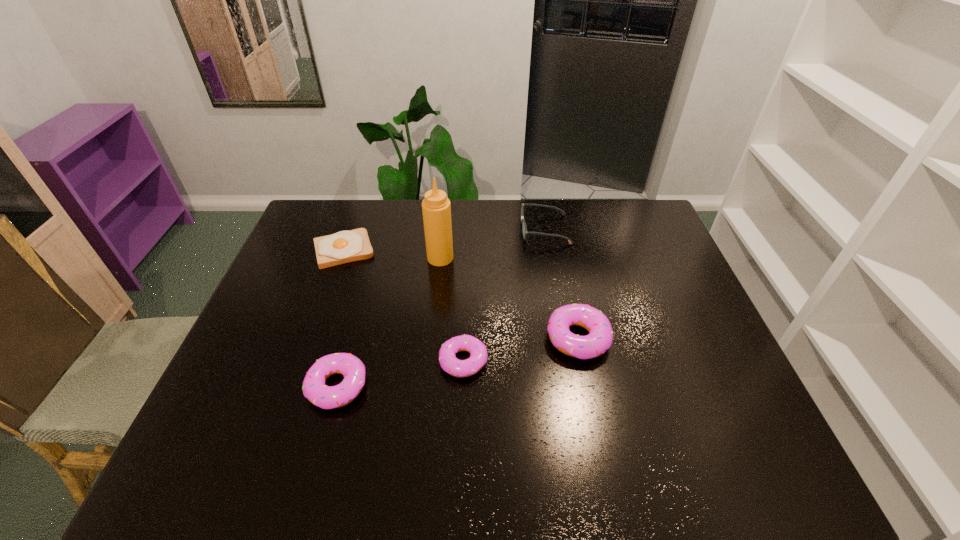
This screenshot has width=960, height=540. I want to click on vacant space at the near edge, so click(533, 419).

You are a GUI agent. You are given a task and a screenshot of the screen. Output one action in this format:
    pyautogui.click(x=<x>, y=<y>)
    Task: Click on the vacant area at the left edge
    
    Given the screenshot: What is the action you would take?
    pyautogui.click(x=296, y=269)

Identify the location of vacant space at the right edge. The height and width of the screenshot is (540, 960). (660, 332).

Locate an element on the screen. The image size is (960, 540). vacant space at the far left corner of the desktop is located at coordinates (322, 211).

Where is `blank space at the far right corner of the desktop`? blank space at the far right corner of the desktop is located at coordinates (636, 202).

The width and height of the screenshot is (960, 540). Identify the location of empty location between the shortest doughnut and the second tallest doughnut. (400, 374).

Locate an element on the screen. This screenshot has width=960, height=540. blank region between the toast and the rightmost doughnut is located at coordinates coord(461,294).

Where is `free spot between the condiment and the rightmost doughnut`? This screenshot has width=960, height=540. free spot between the condiment and the rightmost doughnut is located at coordinates click(x=509, y=298).

What are the coordinates of `vacant area that lies between the second tallest doughnut and the toast` in the screenshot? It's located at (341, 318).

I want to click on vacant region between the tallest object and the shortest doughnut, so click(452, 309).